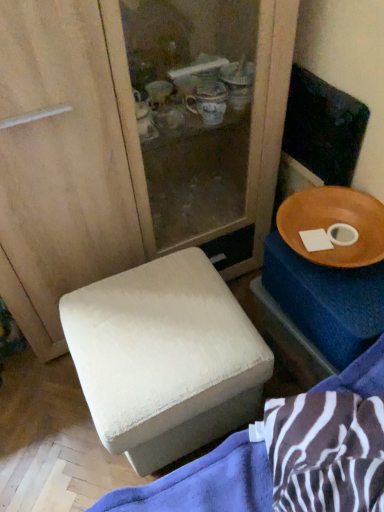
Find the location of a particular element. The height and width of the screenshot is (512, 384). free space above white fabric ottoman at lower left (from a real-world perspective) is located at coordinates (155, 326).